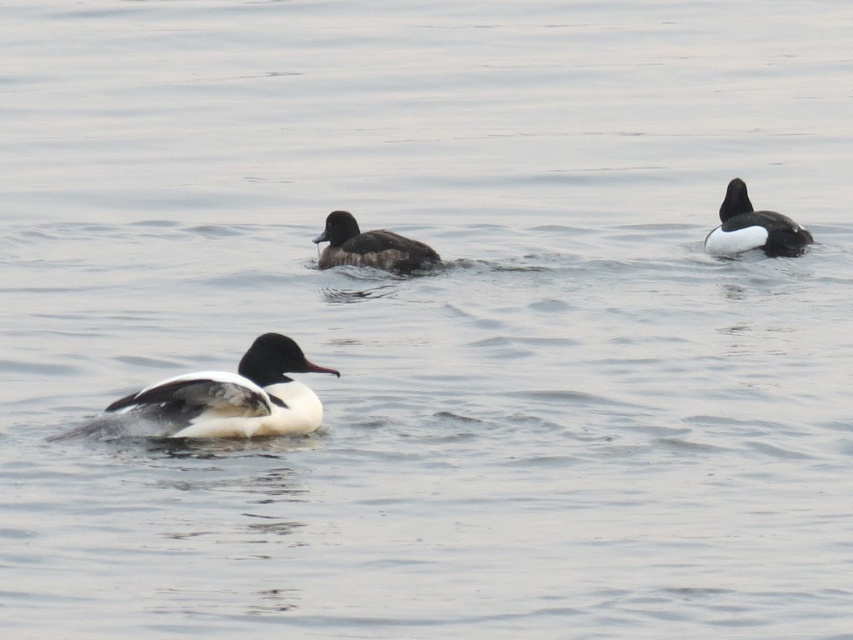
Is point (310, 371) positioned behind point (780, 244)?

No.

The image size is (853, 640). I want to click on white matte duck at center, so click(225, 397).

Locate an element on the screen. Image resolution: width=853 pixels, height=640 pixels. white matte duck at center is located at coordinates (225, 397).

How much distance is there between white matte duck at upper right and dark brown feathers at center?

They are 1.51 meters apart.

Can you confirm if white matte duck at upper right is positioned below dark brown feathers at center?

No, white matte duck at upper right is not below dark brown feathers at center.

Which is in front, point (726, 209) or point (329, 221)?

Point (329, 221) is more forward.

You are a GUI agent. You are given a task and a screenshot of the screen. Output one action in this format:
    pyautogui.click(x=<x>, y=<y>)
    Task: Click on the white matte duck at upper right
    The width and height of the screenshot is (853, 640).
    Given the screenshot: What is the action you would take?
    pyautogui.click(x=752, y=227)

Can you confirm if white matte duck at center is bigger than dark brown feathers at center?

Correct, white matte duck at center is larger in size than dark brown feathers at center.

Who is more distant from viewer, (128, 404) or (335, 252)?

Point (335, 252)

Identify the location of white matte duck at center. (225, 397).

Identify the location of white matte duck at center. The width and height of the screenshot is (853, 640). (225, 397).